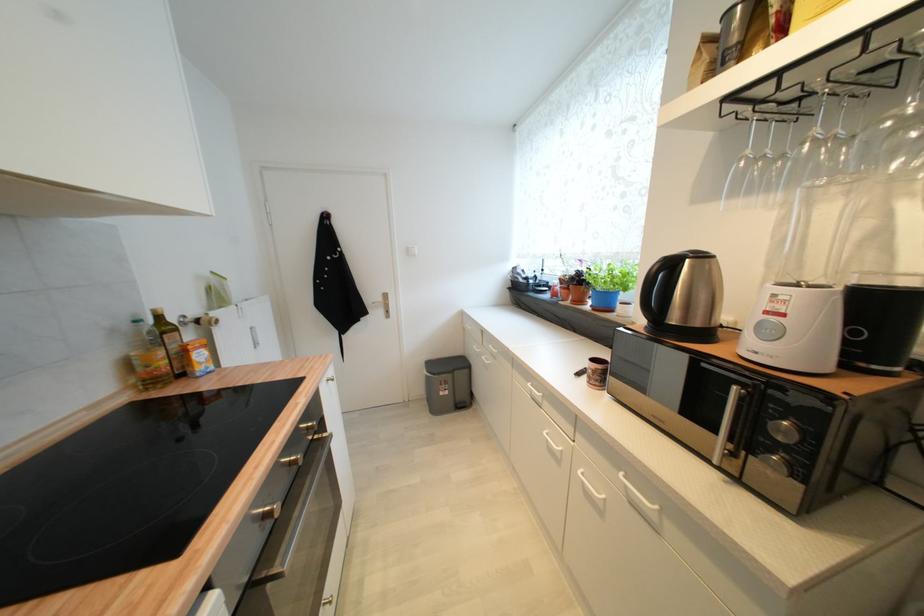
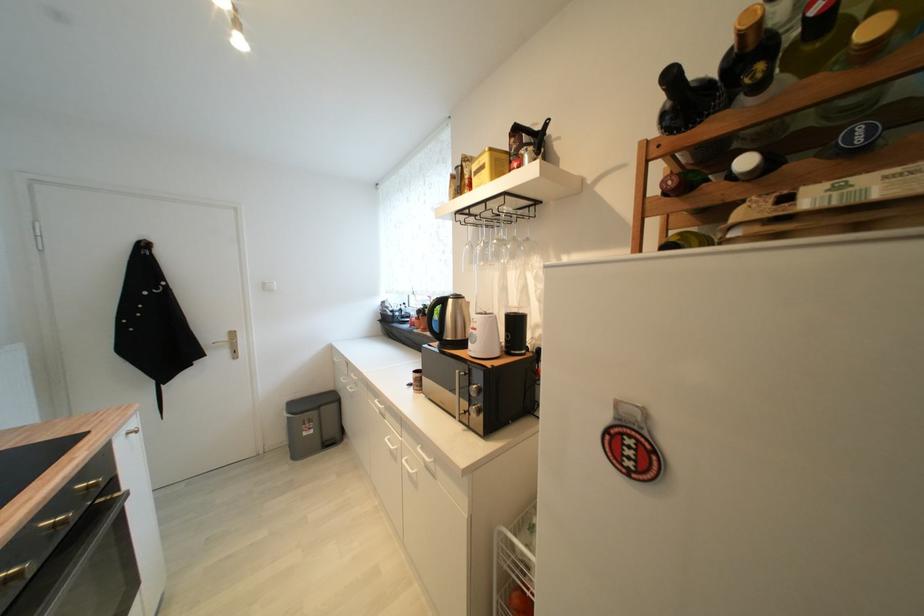
Where in the second image is the point corresponding to (x=414, y=254) from the first image?

(271, 289)